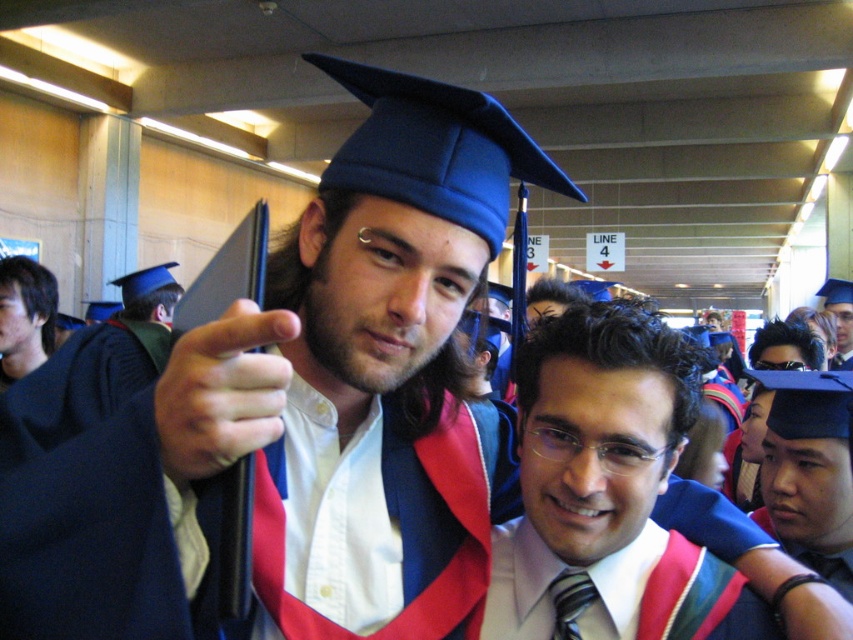
Can you confirm if matte black graduation gown at left is positioned above smooth black hair at left?

Indeed, matte black graduation gown at left is positioned over smooth black hair at left.

Between matte black graduation gown at left and smooth black hair at left, which one is positioned lower?

smooth black hair at left is below.

Which is behind, point (143, 353) or point (35, 342)?

The point (35, 342) is more distant.

In order to click on matte black graduation gown at left in this screenshot , I will do `click(90, 371)`.

Is matte black graduation gown at left to the right of matte blue graduation cap at center from the viewer's perspective?

No, matte black graduation gown at left is not to the right of matte blue graduation cap at center.

Is matte black graduation gown at left taller than matte blue graduation cap at center?

Incorrect, matte black graduation gown at left's height is not larger of matte blue graduation cap at center's.

At what (x,y) coordinates should I click in order to perform the action: click on matte black graduation gown at left. Please return your answer as a coordinate pair (x, y). This screenshot has height=640, width=853. Looking at the image, I should click on (90, 371).

Looking at this image, can you confirm if matte black hand at center is positioned above matte blue graduation cap at upper center?

Actually, matte black hand at center is below matte blue graduation cap at upper center.

Is matte black hand at center smaller than matte blue graduation cap at upper center?

Yes.

Does point (230, 428) come closer to viewer compared to point (845, 339)?

That is True.

At what (x,y) coordinates should I click in order to perform the action: click on matte black hand at center. Please return your answer as a coordinate pair (x, y). This screenshot has height=640, width=853. Looking at the image, I should click on (222, 392).